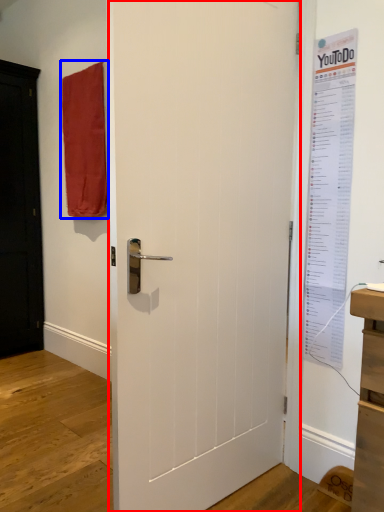
Question: Among these objects, which one is nearest to the camera, door (highlighted by a red box) or curtain (highlighted by a blue box)?

Choices:
 (A) door
 (B) curtain

Answer: (A)